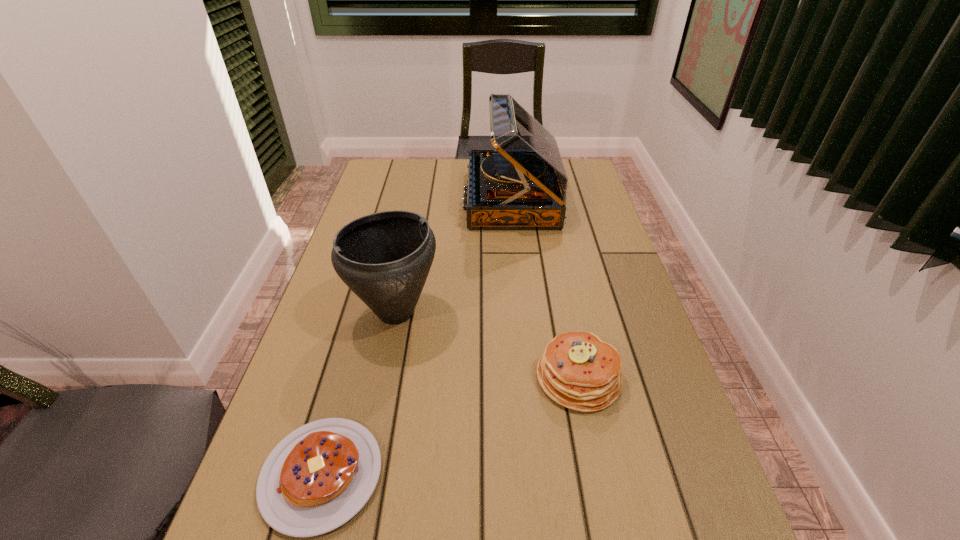
At what (x,y) coordinates should I click in order to perform the action: click on vacant point located between the farthest object and the third shortest object. Please return your answer as a coordinate pair (x, y). The image size is (960, 540). Looking at the image, I should click on (454, 255).

The image size is (960, 540). I want to click on free space between the record player and the third shortest object, so click(454, 255).

Identify the location of empty space that is in between the right pancake and the third shortest object. This screenshot has height=540, width=960. (487, 345).

Identify the location of object that stands as the second closest to the urn. (579, 371).

Choose which object is the nearest neighbor to the record player. Please provide its 2D coordinates. Your answer should be formatted as a tuple, i.e. [(x, y)], where the tuple contains the x and y coordinates of a point satisfying the conditions above.

[(384, 258)]